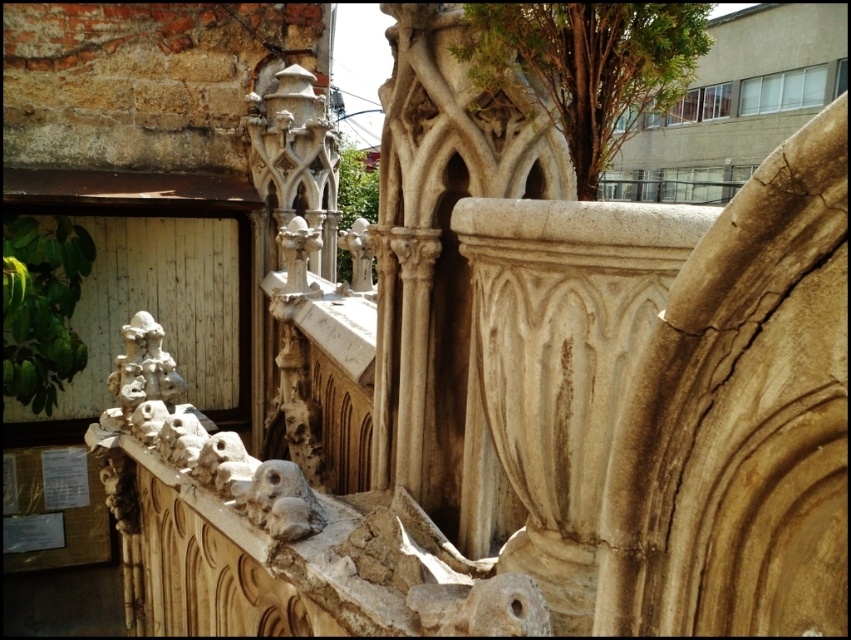
Can you confirm if carved stone sculpture at lower left is thinner than stone carving at center?

No, carved stone sculpture at lower left is not thinner than stone carving at center.

Does carved stone sculpture at lower left have a greater height compared to stone carving at center?

Indeed, carved stone sculpture at lower left has a greater height compared to stone carving at center.

Is point (146, 380) closer to viewer compared to point (289, 502)?

No, (146, 380) is behind (289, 502).

Where is `carved stone sculpture at lower left`? This screenshot has height=640, width=851. carved stone sculpture at lower left is located at coordinates (141, 371).